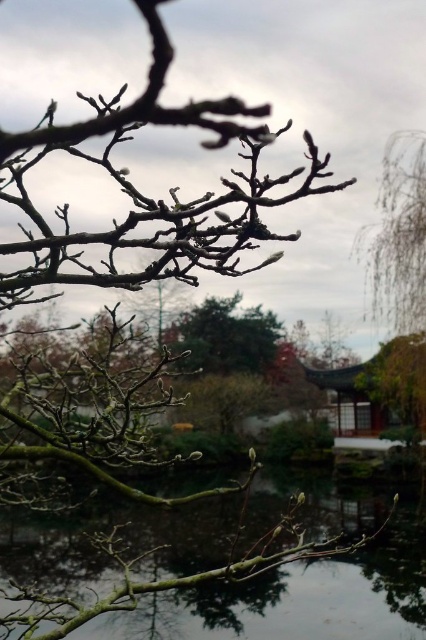
Question: Is bare branches at upper center bigger than green matte tree branch at center?

Choices:
 (A) no
 (B) yes

Answer: (A)

Question: Which of the following is the farthest from the observer?

Choices:
 (A) bare branches at upper center
 (B) green matte tree branch at center

Answer: (B)

Question: From the image, what is the correct spatial relationship of bare branches at upper center in relation to green matte tree branch at center?

Choices:
 (A) left
 (B) right

Answer: (A)

Question: Is bare branches at upper center thinner than green matte tree branch at center?

Choices:
 (A) no
 (B) yes

Answer: (B)